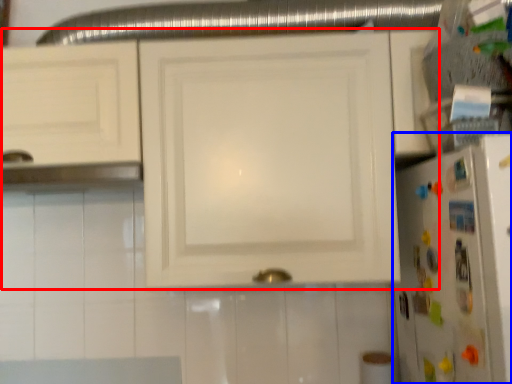
Question: Among these objects, which one is farthest to the camera, cabinetry (highlighted by a red box) or refrigerator (highlighted by a blue box)?

Choices:
 (A) cabinetry
 (B) refrigerator

Answer: (A)